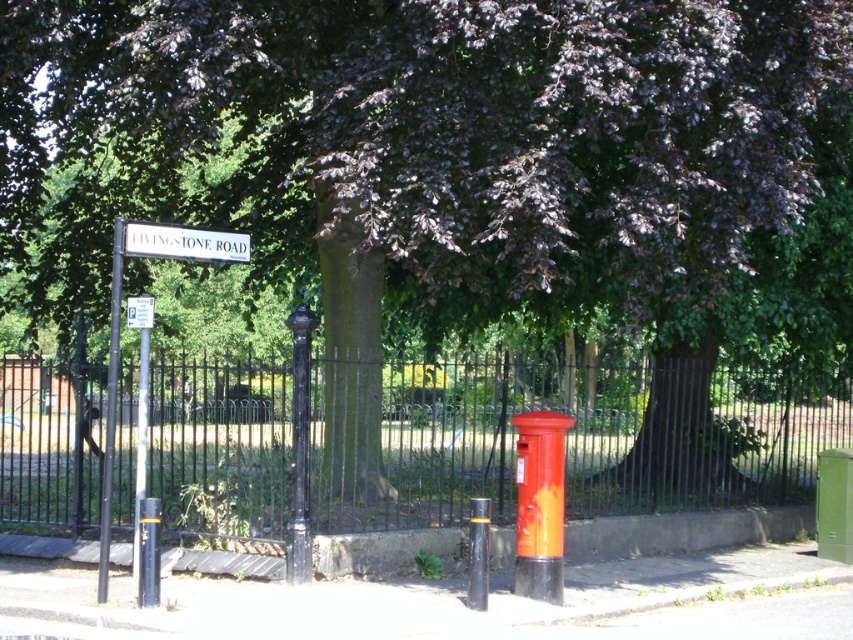
You are a delivery person carrying a package that is 4 meters long. You need to navigate between the black metal fence at center and the brushed metal signpost at left. Can you fit your package through the space between them?

The distance between the black metal fence at center and the brushed metal signpost at left is 3.73 meters. Since your package is 4 meters long, it is longer than the available space, so the package cannot fit through the gap between them.

You are a delivery person trying to navigate a street corner with a large tree. You see a white plastic street sign at upper left and a black metal pole at left. Which object is positioned higher relative to the other?

The white plastic street sign at upper left is located above the black metal pole at left, so it is positioned higher.

You are a delivery person trying to navigate a narrow alleyway. You need to pass between the white plastic street sign at upper left and the black metal pole at left. Can you fit through if your delivery cart is 1.2 meters wide?

The white plastic street sign at upper left might be wider than black metal pole at left, so the space between them could be wider than the cart. However, since the exact width difference isn not specified, it is uncertain if the cart will fit. Proceed with caution.